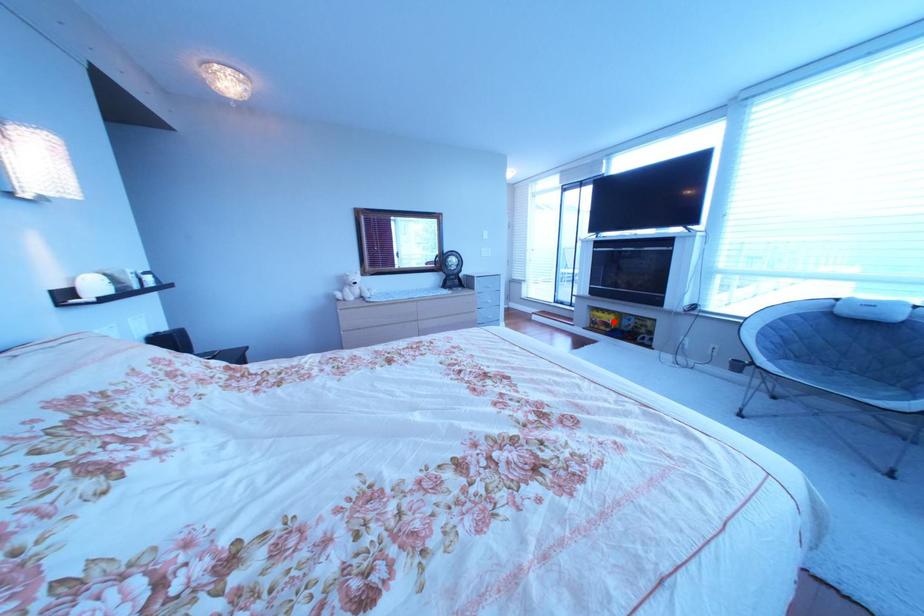
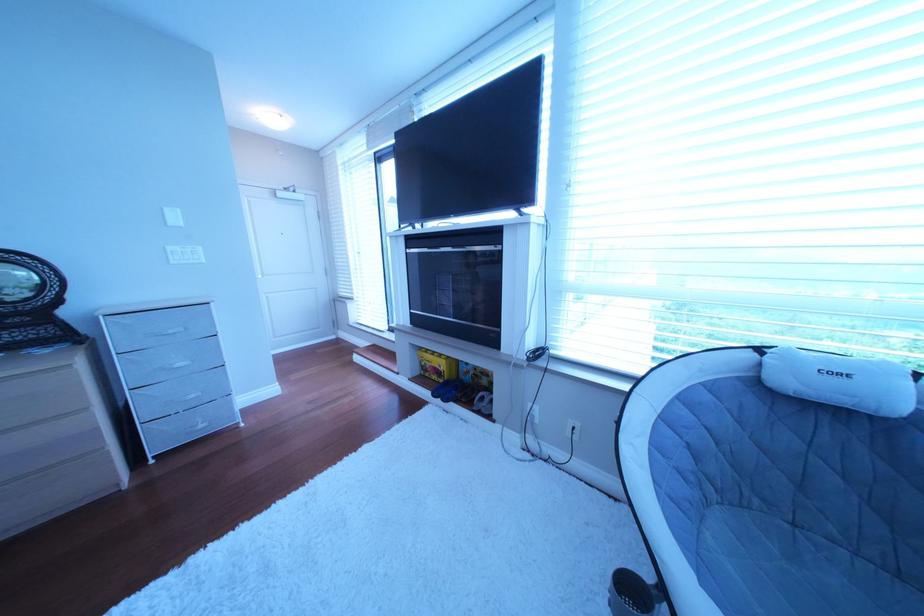
Locate, in the second image, the point that corresponds to the highlighted location in the first image.

(444, 367)